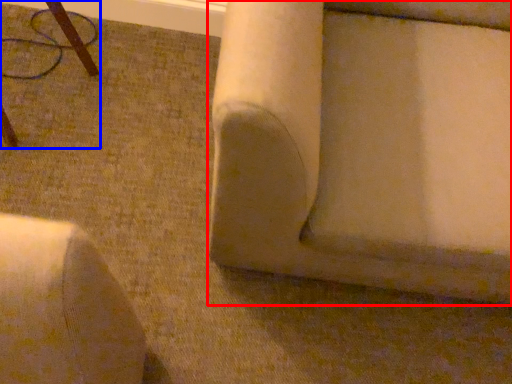
Question: Which object appears closest to the camera in this image, furniture (highlighted by a red box) or furniture (highlighted by a blue box)?

Choices:
 (A) furniture
 (B) furniture

Answer: (A)